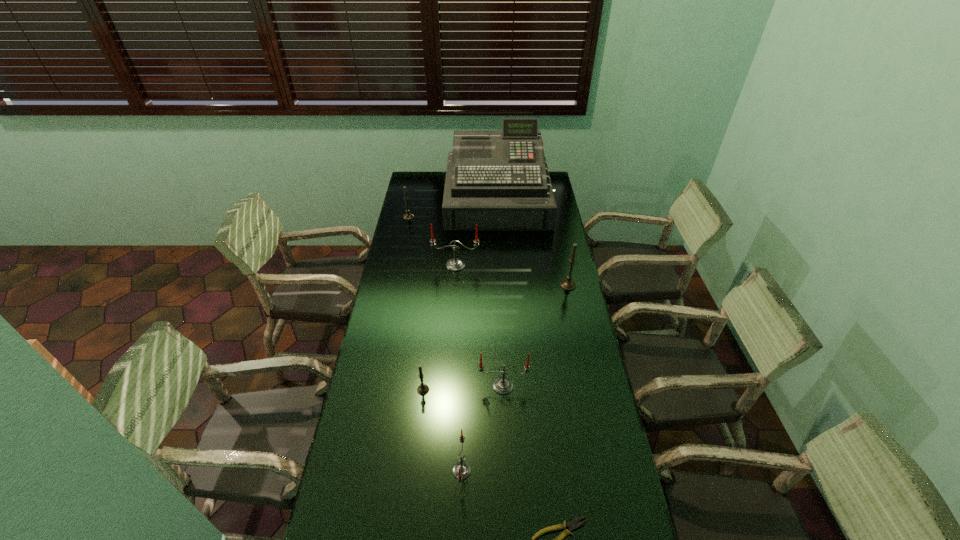
At what (x,y) coordinates should I click in order to perform the action: click on free space that satisfies the following two spatial constraints: 1. on the front-facing side of the second nearest red candle; 2. on the front-facing side of the nearest candle. Please return your answer as a coordinate pair (x, y). This screenshot has width=960, height=540. Looking at the image, I should click on (507, 471).

Image resolution: width=960 pixels, height=540 pixels. In order to click on vacant region that satisfies the following two spatial constraints: 1. on the front-facing side of the fourth nearest candle; 2. on the right side of the tallest object in this screenshot , I will do `click(502, 285)`.

Locate an element on the screen. The height and width of the screenshot is (540, 960). free spot that satisfies the following two spatial constraints: 1. on the front-facing side of the tallest object; 2. on the front-facing side of the nearest candle is located at coordinates (512, 471).

Locate an element on the screen. The image size is (960, 540). free space that satisfies the following two spatial constraints: 1. on the front-facing side of the third farthest object; 2. on the right side of the biggest gray candle is located at coordinates (454, 285).